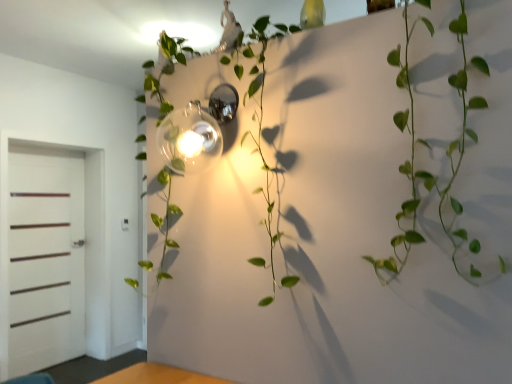
Question: Is green leafy vine at center placed right next to white matte door at left?

Choices:
 (A) yes
 (B) no

Answer: (B)

Question: From the image's perspective, is green leafy vine at center above white matte door at left?

Choices:
 (A) no
 (B) yes

Answer: (B)

Question: Is green leafy vine at center behind white matte door at left?

Choices:
 (A) yes
 (B) no

Answer: (B)

Question: From a real-world perspective, does green leafy vine at center sit lower than white matte door at left?

Choices:
 (A) no
 (B) yes

Answer: (A)

Question: Is green leafy vine at center wider than white matte door at left?

Choices:
 (A) no
 (B) yes

Answer: (B)

Question: Considering the positions of polished chrome sconce at center and green leafy vine at center in the image, is polished chrome sconce at center taller or shorter than green leafy vine at center?

Choices:
 (A) short
 (B) tall

Answer: (A)

Question: In terms of width, does polished chrome sconce at center look wider or thinner when compared to green leafy vine at center?

Choices:
 (A) wide
 (B) thin

Answer: (B)

Question: Would you say polished chrome sconce at center is inside or outside green leafy vine at center?

Choices:
 (A) inside
 (B) outside

Answer: (A)

Question: Is point (169, 150) closer or farther from the camera than point (156, 87)?

Choices:
 (A) closer
 (B) farther

Answer: (A)

Question: Based on their sizes in the image, would you say green leafy vine at center is bigger or smaller than green leafy vine at center?

Choices:
 (A) big
 (B) small

Answer: (B)

Question: Does point (466, 26) appear closer or farther from the camera than point (260, 120)?

Choices:
 (A) closer
 (B) farther

Answer: (A)

Question: Considering their positions, is green leafy vine at center located in front of or behind green leafy vine at center?

Choices:
 (A) behind
 (B) front

Answer: (B)

Question: From the image's perspective, is green leafy vine at center located above or below green leafy vine at center?

Choices:
 (A) below
 (B) above

Answer: (A)

Question: In the image, is white matte door at left on the left side or the right side of polished chrome sconce at center?

Choices:
 (A) right
 (B) left

Answer: (B)

Question: Is point (24, 182) closer or farther from the camera than point (205, 117)?

Choices:
 (A) closer
 (B) farther

Answer: (B)